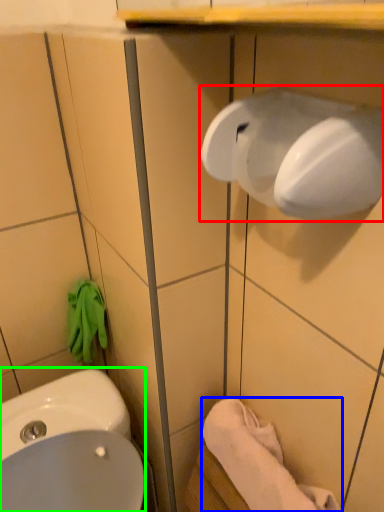
Question: Estimate the real-world distances between objects in this image. Which object is farther from hand dryer (highlighted by a red box), towel/napkin (highlighted by a blue box) or sink (highlighted by a green box)?

Choices:
 (A) towel/napkin
 (B) sink

Answer: (B)